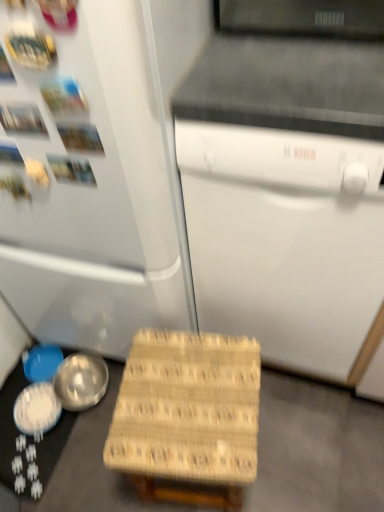
You are a GUI agent. You are given a task and a screenshot of the screen. Output one action in this format:
    pyautogui.click(x=<x>, y=<y>)
    Task: Click on the free location in front of shiny metallic bowl at lower left, the third bowl when ordered from left to right
    This screenshot has width=384, height=512.
    Given the screenshot: What is the action you would take?
    pyautogui.click(x=86, y=448)